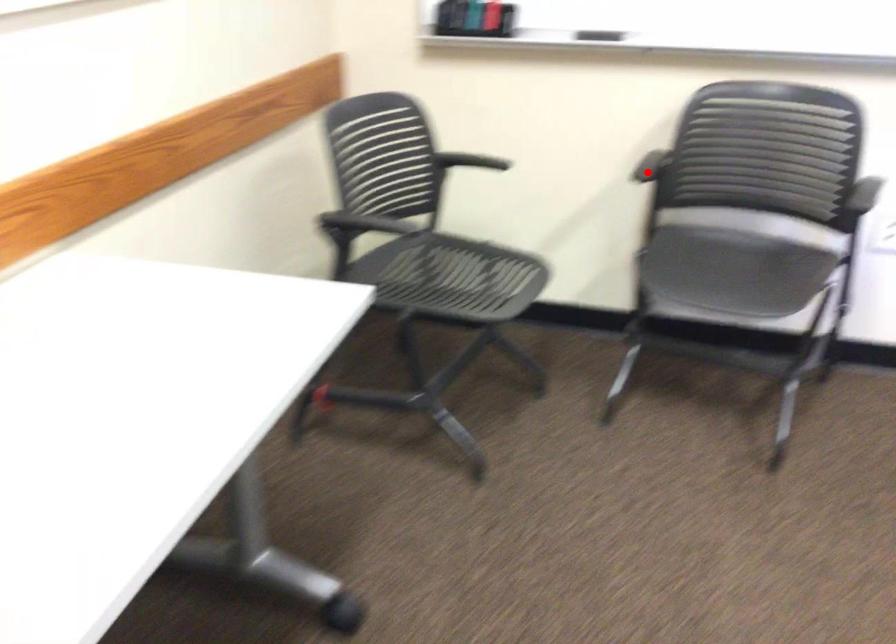
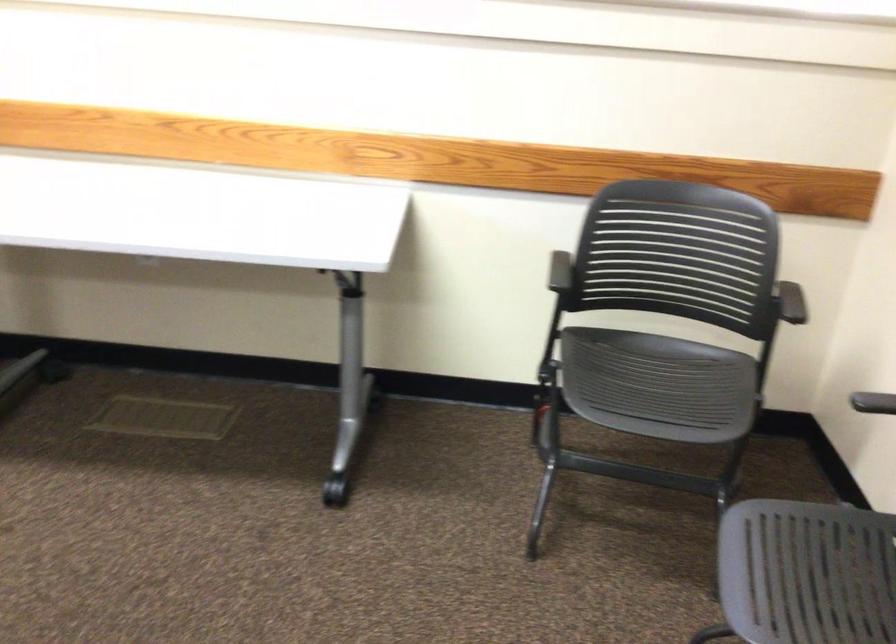
Question: A red point is marked in image1. In image2, is the corresponding 3D point closer to the camera or farther? Reply with the corresponding letter.

Choices:
 (A) The corresponding 3D point is closer.
 (B) The corresponding 3D point is farther.

Answer: (A)